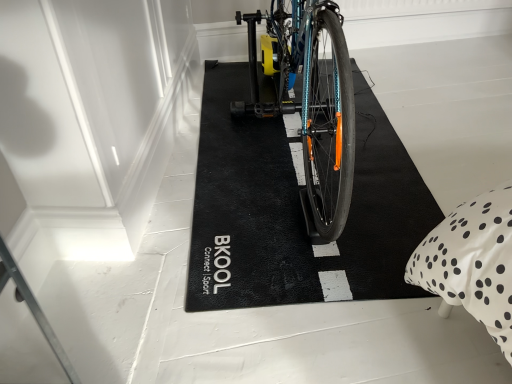
The height and width of the screenshot is (384, 512). What do you see at coordinates (296, 209) in the screenshot?
I see `black rubber yoga mat at center` at bounding box center [296, 209].

Where is `black rubber yoga mat at center`? The width and height of the screenshot is (512, 384). black rubber yoga mat at center is located at coordinates (296, 209).

Locate an element on the screen. Image resolution: width=512 pixels, height=384 pixels. black rubber yoga mat at center is located at coordinates (296, 209).